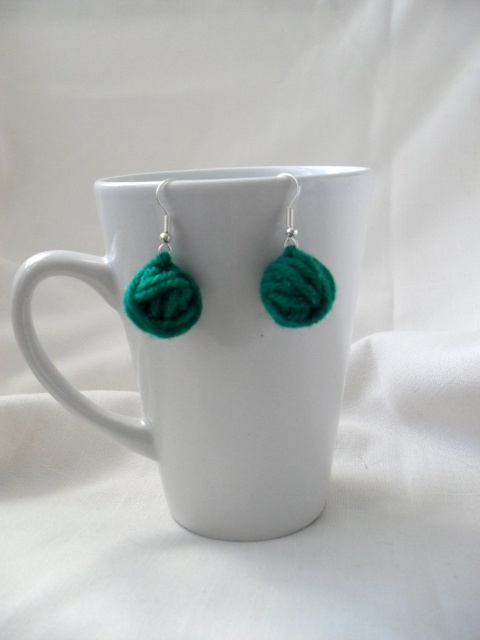
Question: Which point appears closest to the camera in this image?

Choices:
 (A) (335, 310)
 (B) (172, 324)

Answer: (B)

Question: Which point is closer to the camera?

Choices:
 (A) (202, 500)
 (B) (273, 288)

Answer: (B)

Question: Observing the image, what is the correct spatial positioning of green yarn ball at left in reference to green yarn ball at center?

Choices:
 (A) right
 (B) left

Answer: (B)

Question: Does white ceramic mug at center appear under green yarn ball at center?

Choices:
 (A) yes
 (B) no

Answer: (A)

Question: Can you confirm if green yarn ball at left is wider than green yarn ball at center?

Choices:
 (A) no
 (B) yes

Answer: (B)

Question: Based on their relative distances, which object is nearer to the green yarn ball at center?

Choices:
 (A) white ceramic mug at center
 (B) green yarn ball at left

Answer: (B)